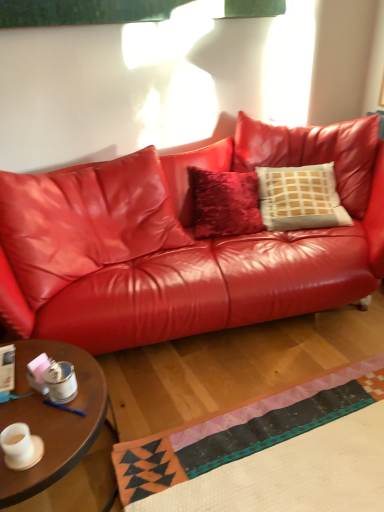
Locate an element on the screen. The image size is (384, 512). free spot behind matte white cup at lower left is located at coordinates (46, 408).